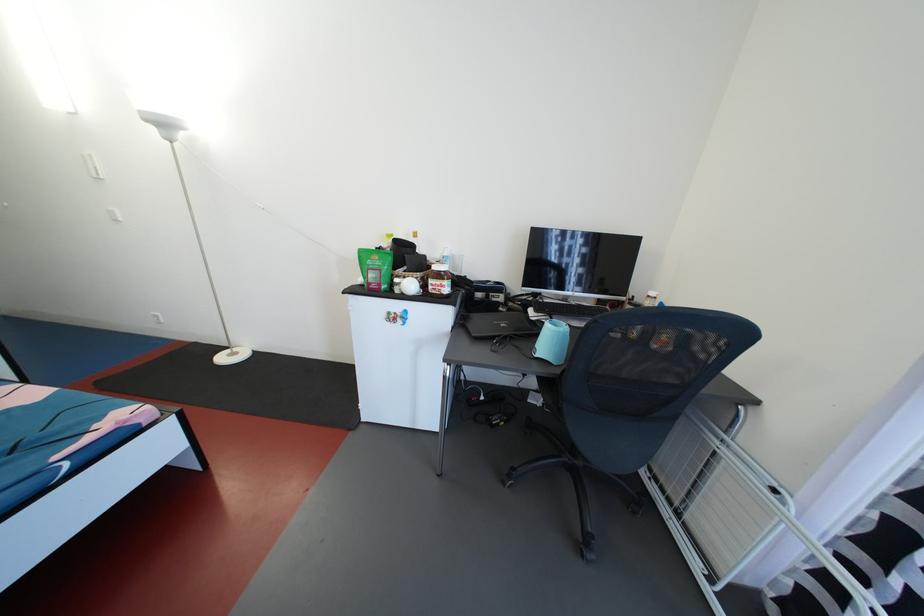
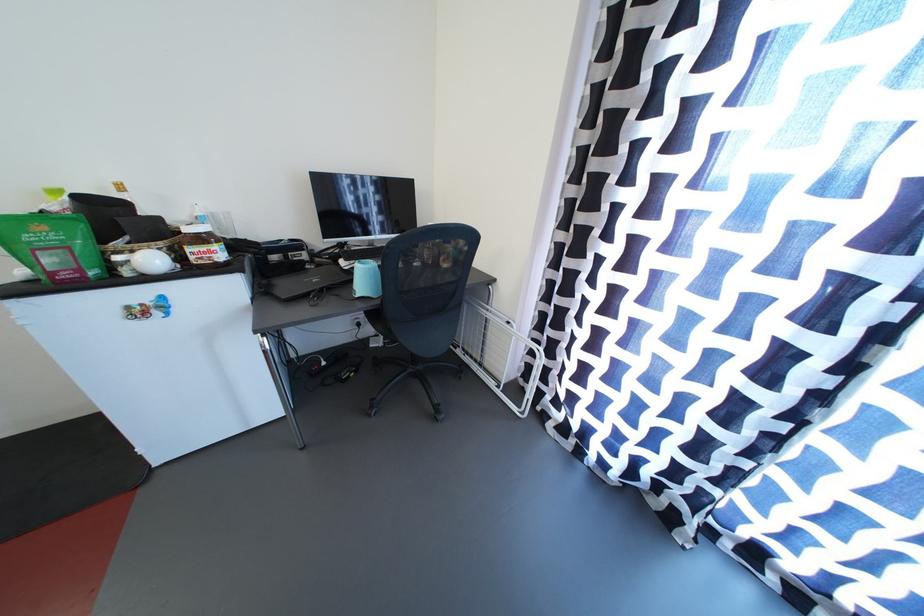
Locate, in the second image, the point that corresponds to point 442,272 in the first image.

(195, 235)